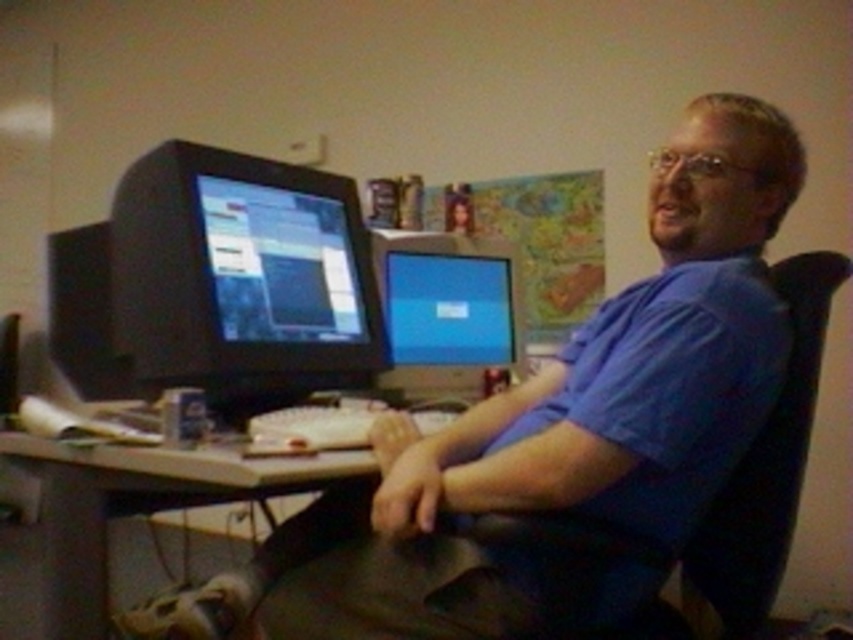
Is the position of matte black monitor at left less distant than that of matte black monitor at center?

Yes, it is in front of matte black monitor at center.

Identify the location of matte black monitor at left. Image resolution: width=853 pixels, height=640 pixels. (242, 275).

Locate an element on the screen. This screenshot has width=853, height=640. matte black monitor at left is located at coordinates (242, 275).

Can you confirm if matte black monitor at left is positioned to the right of wooden desk at center?

Correct, you'll find matte black monitor at left to the right of wooden desk at center.

Is the position of matte black monitor at left more distant than that of wooden desk at center?

Yes, it is behind wooden desk at center.

Who is more forward, (157, 228) or (102, 483)?

Positioned in front is point (102, 483).

You are a GUI agent. You are given a task and a screenshot of the screen. Output one action in this format:
    pyautogui.click(x=<x>, y=<y>)
    Task: Click on the matte black monitor at left
    
    Given the screenshot: What is the action you would take?
    pyautogui.click(x=242, y=275)

Who is positioned more to the right, blue matte shirt at center or wooden desk at center?

blue matte shirt at center is more to the right.

Is point (264, 544) farther from viewer compared to point (68, 534)?

Yes, point (264, 544) is behind point (68, 534).

Identify the location of blue matte shirt at center. (554, 436).